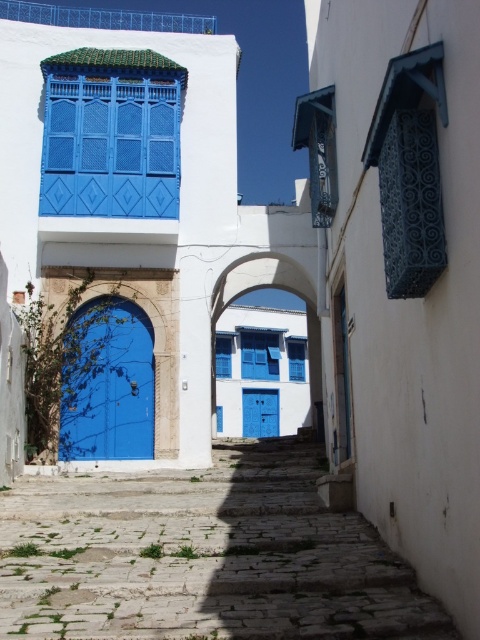
You are a tourist exploring the narrow alleyway and want to reach the open space ahead. You see the stone cobblestone stairs at center and the white stone archway at center. Which one should you go through to reach the open space?

The stone cobblestone stairs at center is located below the white stone archway at center, so you should go through the white stone archway at center to reach the open space ahead.